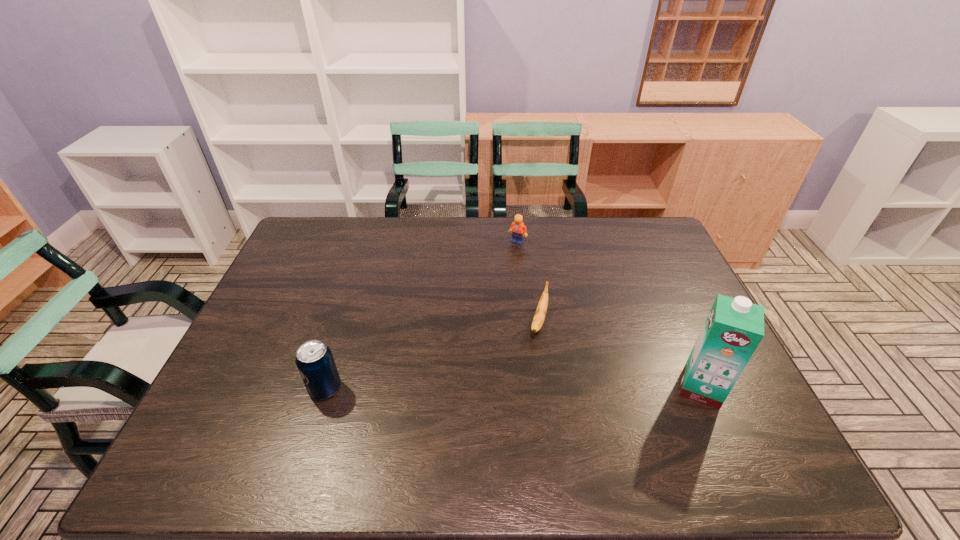
Find the location of a particular element. vacant spot on the desktop that is between the second tallest object and the tallest object and is positioned on the front-facing side of the third tallest object is located at coordinates (492, 388).

I want to click on free space on the desktop that is between the third shortest object and the carton and is positioned on the peel of the banana from the top, so click(518, 388).